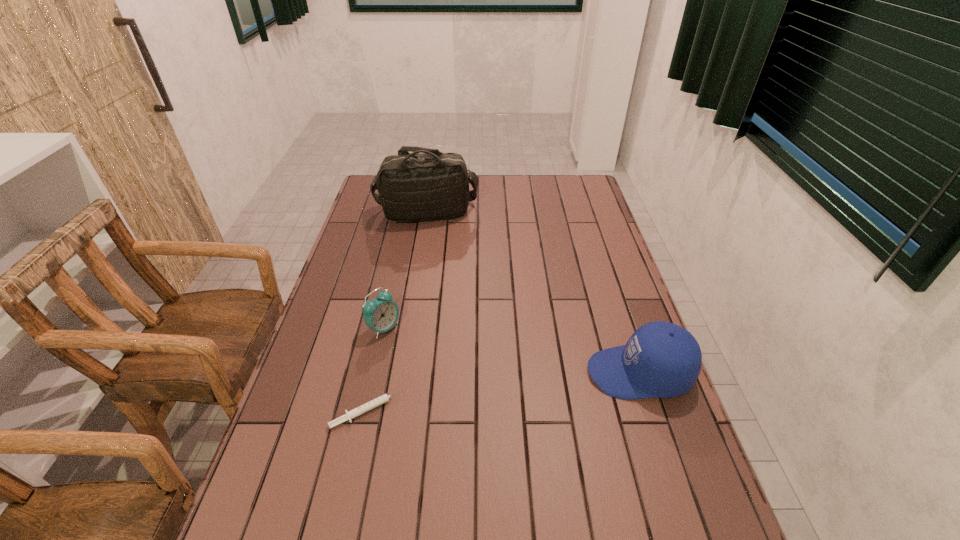
Find the location of a particular element. This screenshot has height=540, width=960. free space that satisfies the following two spatial constraints: 1. on the front side of the alarm clock; 2. on the left side of the shortest object is located at coordinates (366, 410).

Where is `vacant region that satisfies the following two spatial constraints: 1. on the front side of the alarm clock; 2. on the front-facing side of the rightmost object`? The width and height of the screenshot is (960, 540). vacant region that satisfies the following two spatial constraints: 1. on the front side of the alarm clock; 2. on the front-facing side of the rightmost object is located at coordinates (374, 373).